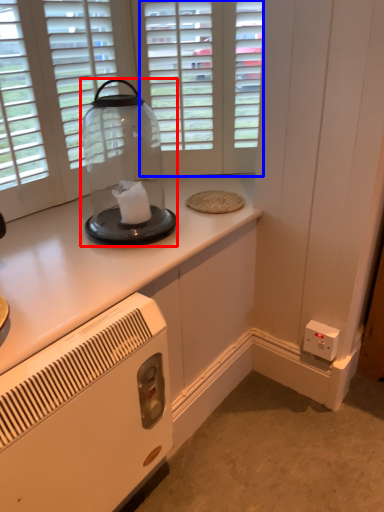
Question: Which object is further to the camera taking this photo, glass jar (highlighted by a red box) or glass door (highlighted by a blue box)?

Choices:
 (A) glass jar
 (B) glass door

Answer: (B)